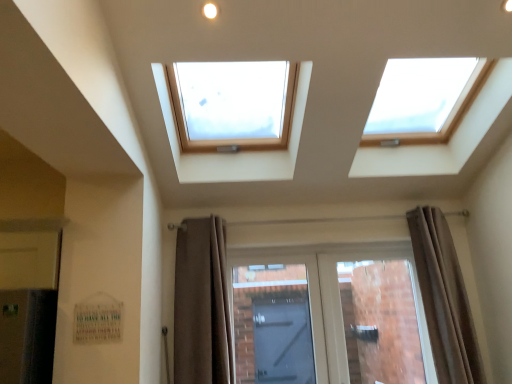
Question: From the image's perspective, is brown fabric curtain at right, the second curtain from the left, above or below brown fabric curtain at lower center, acting as the 2th curtain starting from the right?

Choices:
 (A) above
 (B) below

Answer: (B)

Question: Is point (429, 291) positioned closer to the camera than point (208, 231)?

Choices:
 (A) closer
 (B) farther

Answer: (A)

Question: Estimate the real-world distances between objects in this image. Which object is farther from the matte glass door at center?

Choices:
 (A) brown fabric curtain at right, the first curtain when ordered from right to left
 (B) brown fabric curtain at lower center, acting as the 2th curtain starting from the right

Answer: (B)

Question: Which is nearer to the matte glass door at center?

Choices:
 (A) brown fabric curtain at lower center, the 1th curtain from the left
 (B) brown fabric curtain at right, the second curtain from the left

Answer: (B)